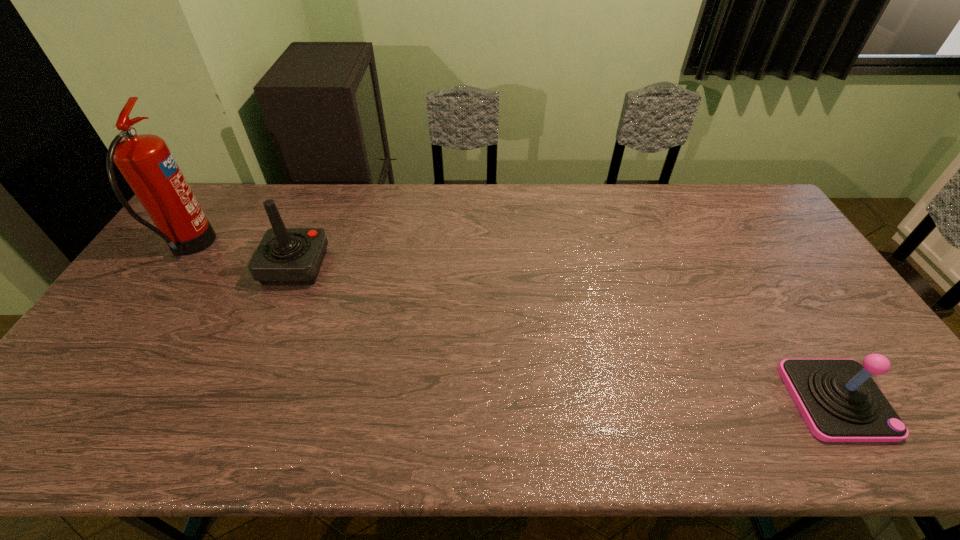
Locate an element on the screen. vacant area that lies between the leftmost object and the shorter joystick is located at coordinates (513, 324).

At what (x,y) coordinates should I click in order to perform the action: click on vacant point located between the fire extinguisher and the second object from right to left. Please return your answer as a coordinate pair (x, y). Looking at the image, I should click on (242, 257).

Locate an element on the screen. Image resolution: width=960 pixels, height=540 pixels. vacant area that lies between the nearest object and the fire extinguisher is located at coordinates (513, 324).

Locate an element on the screen. free point between the second object from right to left and the right joystick is located at coordinates (565, 333).

Locate an element on the screen. The width and height of the screenshot is (960, 540). vacant space that is in between the taller joystick and the rightmost object is located at coordinates (565, 333).

Find the location of a particular element. The height and width of the screenshot is (540, 960). vacant area that lies between the tallest object and the rightmost object is located at coordinates (513, 324).

Locate an element on the screen. The width and height of the screenshot is (960, 540). free space between the shorter joystick and the taller joystick is located at coordinates (565, 333).

Image resolution: width=960 pixels, height=540 pixels. I want to click on vacant area that lies between the second object from right to left and the rightmost object, so click(x=565, y=333).

Identify the location of the closest object relative to the second tallest object. Image resolution: width=960 pixels, height=540 pixels. (145, 161).

Image resolution: width=960 pixels, height=540 pixels. Identify the location of the second closest object to the leftmost object. (839, 401).